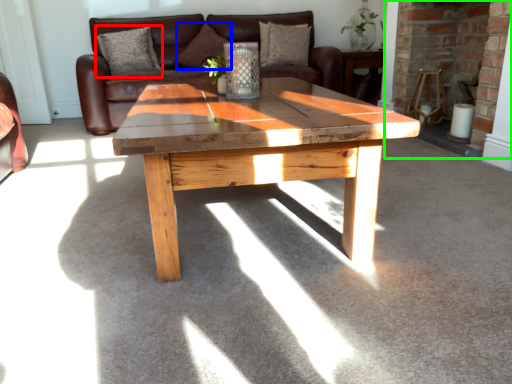
Question: Based on their relative distances, which object is nearer to pillow (highlighted by a red box)? Choose from pillow (highlighted by a blue box) and fireplace (highlighted by a green box).

Choices:
 (A) pillow
 (B) fireplace

Answer: (A)